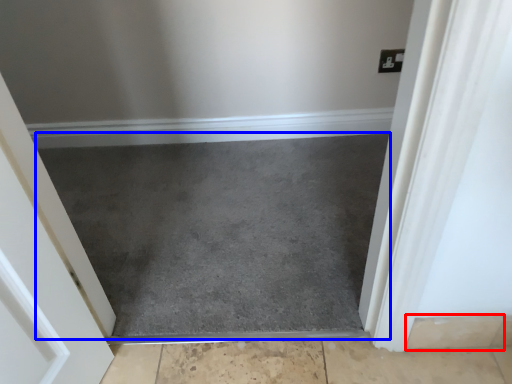
Question: Which of the following is the closest to the observer, concrete (highlighted by a red box) or slate (highlighted by a blue box)?

Choices:
 (A) concrete
 (B) slate

Answer: (A)